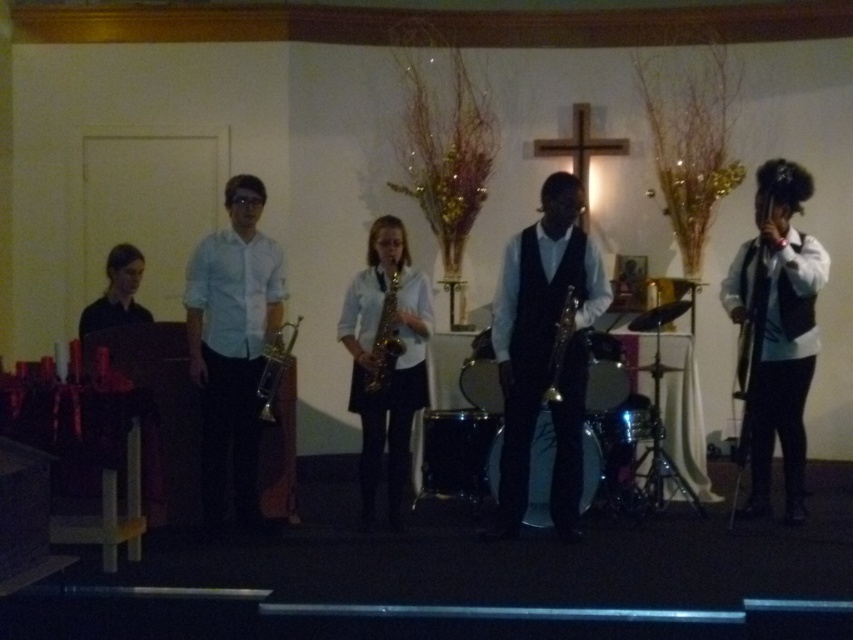
Question: Which of the following is the closest to the observer?

Choices:
 (A) (381, 428)
 (B) (515, 435)
 (C) (560, 346)

Answer: (C)

Question: Which of the following is the farthest from the observer?

Choices:
 (A) black satin vest at center
 (B) gold shiny saxophone at center
 (C) shiny silver saxophone at center

Answer: (B)

Question: From the image, what is the correct spatial relationship of black satin vest at center in relation to gold metallic saxophone at center?

Choices:
 (A) above
 (B) below

Answer: (B)

Question: Does black satin vest at center lie behind gold metallic saxophone at center?

Choices:
 (A) yes
 (B) no

Answer: (B)

Question: Which is farther from the white matte vest at right?

Choices:
 (A) black satin vest at center
 (B) shiny silver saxophone at center
 (C) white glossy shirt at center

Answer: (C)

Question: Observing the image, what is the correct spatial positioning of white glossy shirt at center in reference to gold shiny saxophone at center?

Choices:
 (A) right
 (B) left

Answer: (B)